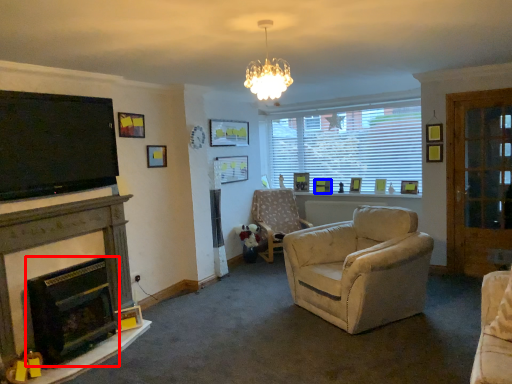
Question: Which of the following is the farthest to the observer, fireplace (highlighted by a red box) or picture frame (highlighted by a blue box)?

Choices:
 (A) fireplace
 (B) picture frame

Answer: (B)